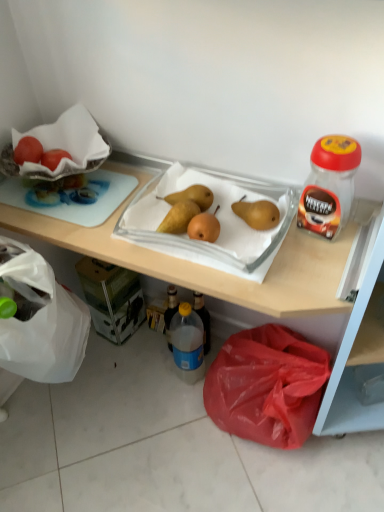
Where is `translucent plastic bottle at lower center`? translucent plastic bottle at lower center is located at coordinates (187, 343).

This screenshot has width=384, height=512. What do you see at coordinates (329, 186) in the screenshot?
I see `translucent plastic jar at right` at bounding box center [329, 186].

This screenshot has height=512, width=384. Describe the element at coordinates (217, 218) in the screenshot. I see `smooth brown pears at center` at that location.

The height and width of the screenshot is (512, 384). Describe the element at coordinates (54, 158) in the screenshot. I see `matte white grapefruit at upper left` at that location.

Describe the element at coordinates (249, 290) in the screenshot. I see `wooden tray at upper center` at that location.

The height and width of the screenshot is (512, 384). What are the coordinates of `translucent plastic bottle at lower center` in the screenshot? It's located at (187, 343).

Is wooden tray at upper center positioned with its back to matte white grapefruit at upper left?

Absolutely, wooden tray at upper center is directed away from matte white grapefruit at upper left.

Between wooden tray at upper center and matte white grapefruit at upper left, which one appears on the left side from the viewer's perspective?

matte white grapefruit at upper left.

Which of these two, wooden tray at upper center or matte white grapefruit at upper left, is thinner?

Thinner between the two is matte white grapefruit at upper left.

From the image's perspective, is wooden tray at upper center positioned above or below matte white grapefruit at upper left?

wooden tray at upper center is situated lower than matte white grapefruit at upper left in the image.

In the scene shown: Is the position of wooden tray at upper center less distant than that of red plastic bag at lower center?

Yes, the depth of wooden tray at upper center is less than that of red plastic bag at lower center.

Between wooden tray at upper center and red plastic bag at lower center, which one appears on the left side from the viewer's perspective?

wooden tray at upper center is more to the left.

Considering the points (269, 284) and (236, 377), which point is behind, point (269, 284) or point (236, 377)?

The point (236, 377) is behind.

Is wooden tray at upper center aimed at red plastic bag at lower center?

Yes, wooden tray at upper center is oriented towards red plastic bag at lower center.

Considering the sizes of objects translucent plastic jar at right and wooden tray at upper center in the image provided, who is wider, translucent plastic jar at right or wooden tray at upper center?

wooden tray at upper center is wider.

Does point (343, 158) come closer to viewer compared to point (357, 413)?

Yes, point (343, 158) is in front of point (357, 413).

From the picture: Can you confirm if translucent plastic jar at right is taller than wooden tray at upper center?

No, translucent plastic jar at right is not taller than wooden tray at upper center.

Identify the location of desk located underneath the translucent plastic jar at right (from a real-world perspective). The image size is (384, 512). (249, 290).

Looking at this image, from the image's perspective, between matte white grapefruit at upper left and wooden tray at upper center, which one is located above?

matte white grapefruit at upper left, from the image's perspective.

Which of these two, matte white grapefruit at upper left or wooden tray at upper center, is smaller?

matte white grapefruit at upper left is smaller.

From a real-world perspective, which is physically below, matte white grapefruit at upper left or wooden tray at upper center?

wooden tray at upper center.

Consider the image. Is matte white grapefruit at upper left to the left or to the right of wooden tray at upper center in the image?

Clearly, matte white grapefruit at upper left is on the left of wooden tray at upper center in the image.

Identify the location of wide that is above the translucent plastic bottle at lower center (from the image's perspective). The height and width of the screenshot is (512, 384). (217, 218).

In the scene shown: Measure the distance between smooth brown pears at center and translucent plastic bottle at lower center.

smooth brown pears at center and translucent plastic bottle at lower center are 17.73 inches apart from each other.

Who is more distant, smooth brown pears at center or translucent plastic bottle at lower center?

translucent plastic bottle at lower center is more distant.

Is smooth brown pears at center oriented towards translucent plastic bottle at lower center?

No, smooth brown pears at center does not turn towards translucent plastic bottle at lower center.

Which of these two, red plastic bag at lower center or wooden tray at upper center, is smaller?

Smaller between the two is red plastic bag at lower center.

Does point (232, 418) come closer to viewer compared to point (352, 325)?

No.

From a real-world perspective, does red plastic bag at lower center stand above wooden tray at upper center?

No, from a real-world perspective, red plastic bag at lower center is not on top of wooden tray at upper center.

Does red plastic bag at lower center appear on the left side of wooden tray at upper center?

No.

Based on the photo, from a real-world perspective, is translucent plastic bottle at lower center physically below red plastic bag at lower center?

No, from a real-world perspective, translucent plastic bottle at lower center is not below red plastic bag at lower center.

Is translucent plastic bottle at lower center directly adjacent to red plastic bag at lower center?

There is a gap between translucent plastic bottle at lower center and red plastic bag at lower center.

Could you tell me if translucent plastic bottle at lower center is facing red plastic bag at lower center?

No, translucent plastic bottle at lower center is not turned towards red plastic bag at lower center.

Does point (173, 352) lie behind point (299, 432)?

Yes, it is.

The height and width of the screenshot is (512, 384). In order to click on grapefruit located above the wooden tray at upper center (from the image's perspective) in this screenshot , I will do `click(54, 158)`.

The image size is (384, 512). I want to click on plastic bag behind the wooden tray at upper center, so click(267, 386).

Estimate the real-world distances between objects in this image. Which object is closer to wooden tray at upper center, red plastic bag at lower center or smooth brown pears at center?

smooth brown pears at center.

Based on their spatial positions, is translucent plastic bottle at lower center or translucent plastic jar at right further from matte white grapefruit at upper left?

translucent plastic bottle at lower center is positioned further to the anchor matte white grapefruit at upper left.

Based on their spatial positions, is red plastic bag at lower center or smooth brown pears at center closer to translucent plastic jar at right?

The object closer to translucent plastic jar at right is smooth brown pears at center.

Which object lies nearer to the anchor point smooth brown pears at center, matte white grapefruit at upper left or translucent plastic jar at right?

The object closer to smooth brown pears at center is translucent plastic jar at right.

Looking at the image, which one is located closer to wooden tray at upper center, translucent plastic bottle at lower center or translucent plastic jar at right?

Among the two, translucent plastic jar at right is located nearer to wooden tray at upper center.

Looking at the image, which one is located further to red plastic bag at lower center, translucent plastic bottle at lower center or smooth brown pears at center?

smooth brown pears at center lies further to red plastic bag at lower center than the other object.

Estimate the real-world distances between objects in this image. Which object is closer to matte white grapefruit at upper left, red plastic bag at lower center or smooth brown pears at center?

Among the two, smooth brown pears at center is located nearer to matte white grapefruit at upper left.

Looking at the image, which one is located closer to red plastic bag at lower center, translucent plastic jar at right or matte white grapefruit at upper left?

translucent plastic jar at right is positioned closer to the anchor red plastic bag at lower center.

Find the location of a particular element. This screenshot has height=512, width=384. bottle between smooth brown pears at center and red plastic bag at lower center vertically is located at coordinates (187, 343).

Find the location of a particular element. This screenshot has height=512, width=384. plastic bag between wooden tray at upper center and matte white grapefruit at upper left in the front-back direction is located at coordinates (267, 386).

The image size is (384, 512). Find the location of `wide positioned between wooden tray at upper center and matte white grapefruit at upper left from near to far`. wide positioned between wooden tray at upper center and matte white grapefruit at upper left from near to far is located at coordinates (217, 218).

This screenshot has width=384, height=512. What are the coordinates of `wide between matte white grapefruit at upper left and translucent plastic bottle at lower center in the vertical direction` in the screenshot? It's located at (217, 218).